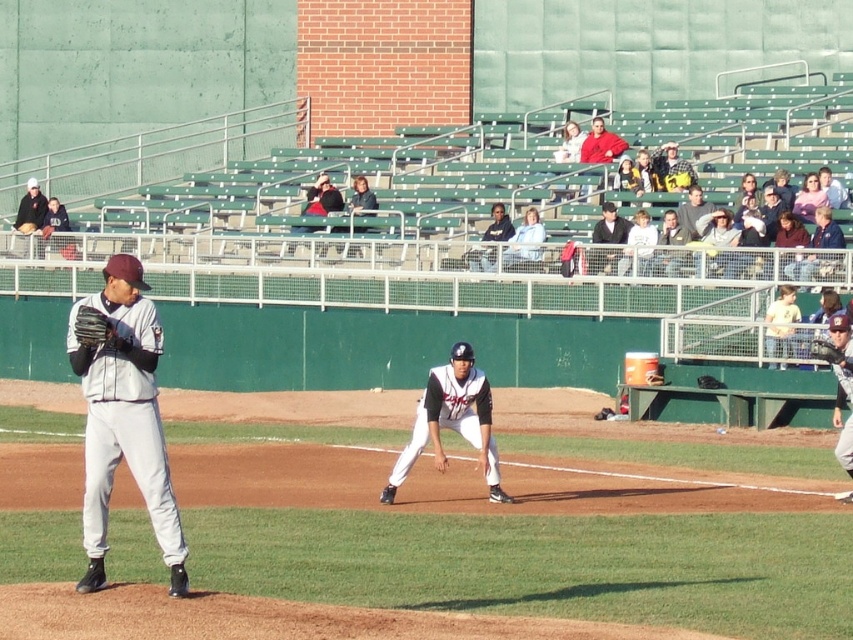
Between point (490, 260) and point (836, 348), which one is positioned behind?

Point (490, 260)

Is point (497, 204) positioned after point (831, 342)?

Yes, point (497, 204) is behind point (831, 342).

Identify the location of dark blue uniform at center. [498, 225].

I want to click on dark blue uniform at center, so click(498, 225).

What do you see at coordinates (692, 211) in the screenshot? The image size is (853, 640). I see `dark gray jacket at upper center` at bounding box center [692, 211].

Identify the location of dark gray jacket at upper center. (692, 211).

Who is more forward, (x=686, y=221) or (x=840, y=196)?

Point (x=686, y=221) is more forward.

Identify the location of dark gray jacket at upper center. (692, 211).

You are a GUI agent. You are given a task and a screenshot of the screen. Output one action in this format:
    pyautogui.click(x=<x>, y=<y>)
    Task: Click on the yellow fabric shirt at upper right
    
    Given the screenshot: What is the action you would take?
    pyautogui.click(x=781, y=323)